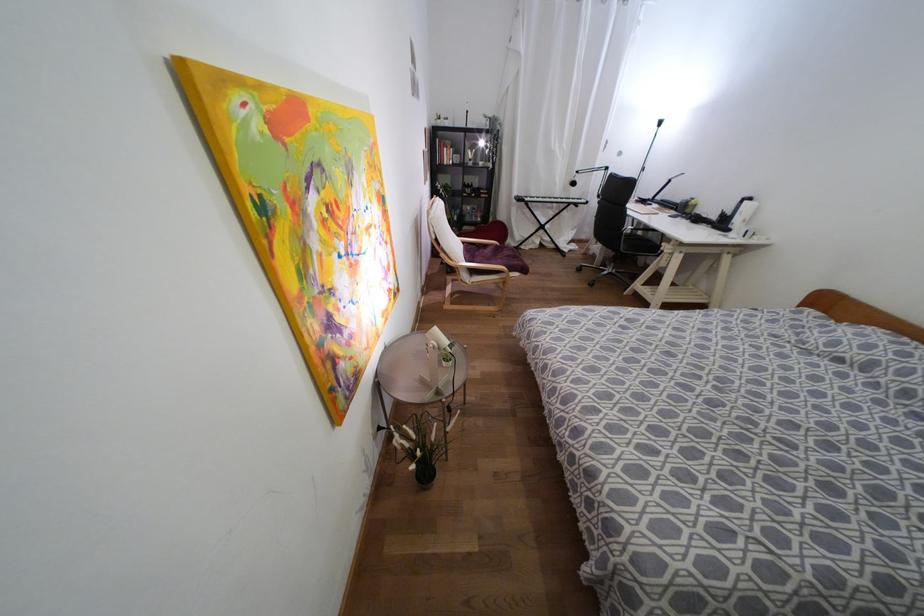
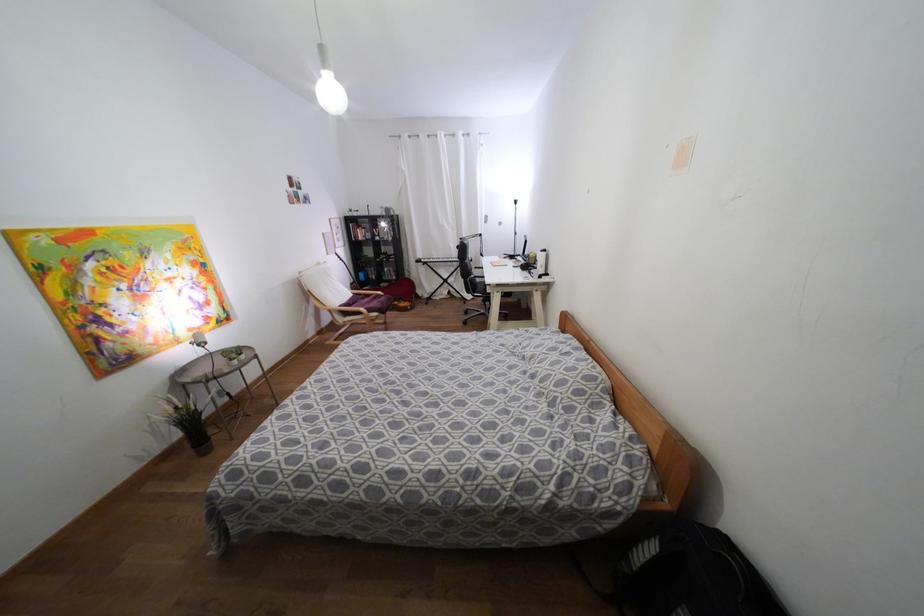
Find the pixel in the second image that matches point 444,161 in the first image.

(359, 238)